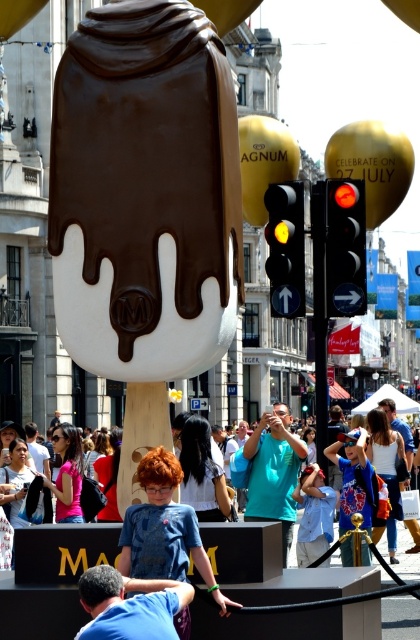
You are a photographer standing at the edge of the crowd. You want to take a photo of the ice cream sculpture while ensuring both the blue cotton shirt at lower center and the denim jacket at center are visible in the frame. Based on their positions, which object should you position closer to the left side of your camera viewfinder?

The blue cotton shirt at lower center should be positioned closer to the left side of the camera viewfinder because it is already to the left of the denim jacket at center in the scene.